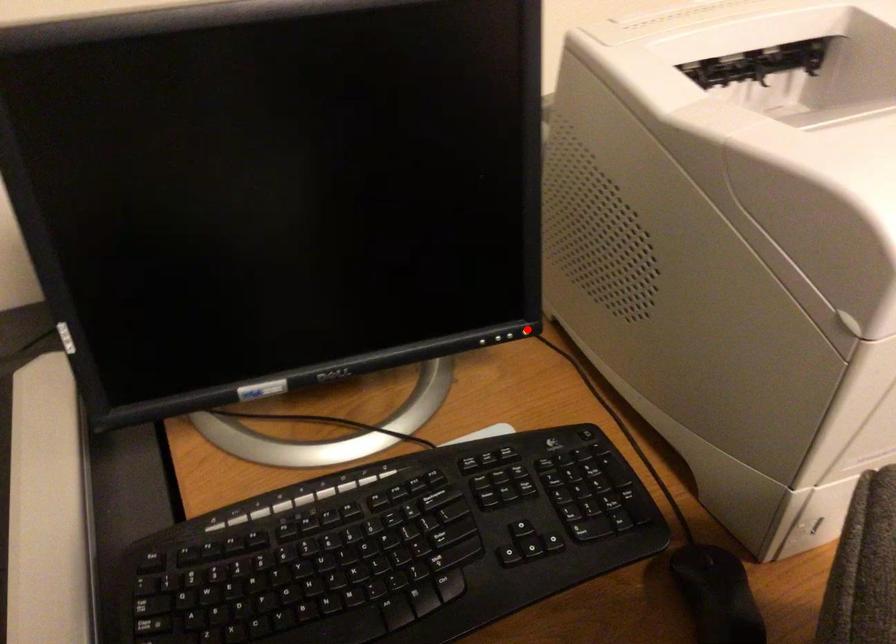
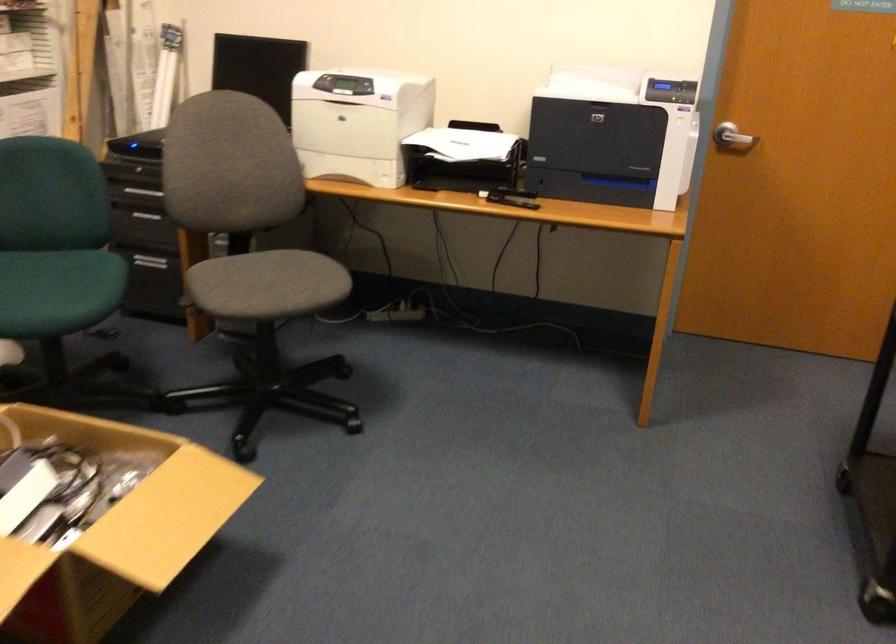
Question: I am providing you with two images of the same scene from different viewpoints. A red point is marked on the first image. Can you still see the location of the red point in image 2?

Choices:
 (A) Yes
 (B) No

Answer: (B)